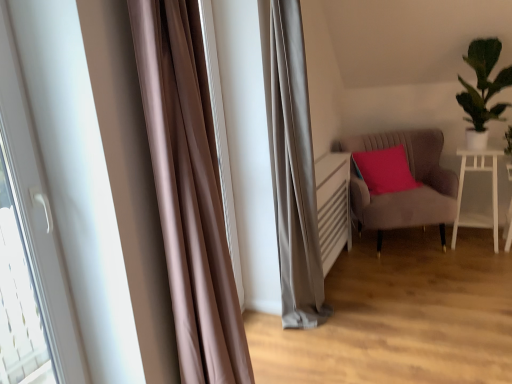
This screenshot has height=384, width=512. What do you see at coordinates (492, 191) in the screenshot?
I see `white glossy table at right` at bounding box center [492, 191].

Locate an element on the screen. The image size is (512, 384). suede-like beige armchair at right is located at coordinates (408, 190).

The width and height of the screenshot is (512, 384). I want to click on green leafy plant at upper right, so click(x=483, y=90).

The height and width of the screenshot is (384, 512). What do you see at coordinates (70, 178) in the screenshot?
I see `white glossy door at left` at bounding box center [70, 178].

This screenshot has width=512, height=384. Identify the location of white glossy table at right. (492, 191).

Is green leafy plant at upper right looking in the opposite direction of white glossy door at left?

No, white glossy door at left is not at the back of green leafy plant at upper right.

Considering the positions of objects green leafy plant at upper right and white glossy door at left in the image provided, who is more to the left, green leafy plant at upper right or white glossy door at left?

Positioned to the left is white glossy door at left.

Is green leafy plant at upper right surrounding white glossy door at left?

No, white glossy door at left is not surrounded by green leafy plant at upper right.

Does point (471, 91) come behind point (74, 277)?

Yes, point (471, 91) is behind point (74, 277).

In terms of width, does satin brown curtain at left look wider or thinner when compared to suede-like beige armchair at right?

satin brown curtain at left is thinner than suede-like beige armchair at right.

Which object is positioned more to the left, satin brown curtain at left or suede-like beige armchair at right?

From the viewer's perspective, satin brown curtain at left appears more on the left side.

From the image's perspective, which is below, satin brown curtain at left or suede-like beige armchair at right?

suede-like beige armchair at right.

Who is more distant, suede-like beige armchair at right or white glossy door at left?

suede-like beige armchair at right.

Consider the image. Is suede-like beige armchair at right shorter than white glossy door at left?

Yes.

Considering the relative positions of suede-like beige armchair at right and white glossy door at left in the image provided, is suede-like beige armchair at right to the left or to the right of white glossy door at left?

Clearly, suede-like beige armchair at right is on the right of white glossy door at left in the image.

Considering the positions of point (442, 144) and point (24, 47), is point (442, 144) closer or farther from the camera than point (24, 47)?

Clearly, point (442, 144) is more distant from the camera than point (24, 47).

From the picture: How many degrees apart are the facing directions of white glossy door at left and white glossy table at right?

There is a 90.9-degree angle between the facing directions of white glossy door at left and white glossy table at right.

Is white glossy door at left positioned with its back to white glossy table at right?

No, white glossy door at left is not facing the opposite direction of white glossy table at right.

From the image's perspective, which is below, white glossy door at left or white glossy table at right?

white glossy door at left appears lower in the image.

Based on the photo, considering the positions of objects suede-like beige armchair at right and satin brown curtain at left in the image provided, who is more to the left, suede-like beige armchair at right or satin brown curtain at left?

satin brown curtain at left.

Is suede-like beige armchair at right not near satin brown curtain at left?

Yes, suede-like beige armchair at right and satin brown curtain at left are located far from each other.

From the image's perspective, who appears lower, suede-like beige armchair at right or satin brown curtain at left?

suede-like beige armchair at right is shown below in the image.

Which is behind, point (365, 209) or point (181, 191)?

The point (365, 209) is farther.

Between white glossy table at right and white glossy door at left, which one has smaller size?

With smaller size is white glossy door at left.

From a real-world perspective, which is physically above, white glossy table at right or white glossy door at left?

white glossy door at left, from a real-world perspective.

Is white glossy table at right wider or thinner than white glossy door at left?

Clearly, white glossy table at right has more width compared to white glossy door at left.

Which object is further away from the camera taking this photo, white glossy table at right or white glossy door at left?

white glossy table at right is more distant.

How different are the orientations of satin brown curtain at left and green leafy plant at upper right in degrees?

satin brown curtain at left and green leafy plant at upper right are facing 90.1 degrees away from each other.

Is satin brown curtain at left completely or partially outside of green leafy plant at upper right?

That's correct, satin brown curtain at left is outside of green leafy plant at upper right.

Considering the relative sizes of satin brown curtain at left and green leafy plant at upper right in the image provided, is satin brown curtain at left wider than green leafy plant at upper right?

No, satin brown curtain at left is not wider than green leafy plant at upper right.

You are a GUI agent. You are given a task and a screenshot of the screen. Output one action in this format:
    pyautogui.click(x=<x>, y=<y>)
    Task: Click on the houseplant above the white glossy door at left (from the image's perspective)
    Image resolution: width=512 pixels, height=384 pixels.
    Given the screenshot: What is the action you would take?
    pyautogui.click(x=483, y=90)

Image resolution: width=512 pixels, height=384 pixels. What are the coordinates of `curtain in front of the suede-like beige armchair at right` in the screenshot? It's located at pyautogui.click(x=189, y=192).

Which object lies further to the anchor point white glossy table at right, white glossy door at left or suede-like beige armchair at right?

Among the two, white glossy door at left is located further to white glossy table at right.

Which object lies further to the anchor point satin brown curtain at left, suede-like beige armchair at right or green leafy plant at upper right?

The object further to satin brown curtain at left is green leafy plant at upper right.

Looking at the image, which one is located closer to suede-like beige armchair at right, white glossy door at left or white glossy table at right?

white glossy table at right lies closer to suede-like beige armchair at right than the other object.

From the image, which object appears to be nearer to white glossy table at right, satin brown curtain at left or white glossy door at left?

A: satin brown curtain at left is closer to white glossy table at right.

From the picture: Looking at the image, which one is located further to suede-like beige armchair at right, white glossy table at right or satin brown curtain at left?

satin brown curtain at left is further to suede-like beige armchair at right.

Considering their positions, is suede-like beige armchair at right positioned further to white glossy door at left than satin brown curtain at left?

Based on the image, suede-like beige armchair at right appears to be further to white glossy door at left.

When comparing their distances from white glossy door at left, does green leafy plant at upper right or suede-like beige armchair at right seem closer?

The object closer to white glossy door at left is suede-like beige armchair at right.

Which object lies nearer to the anchor point green leafy plant at upper right, white glossy door at left or white glossy table at right?

Among the two, white glossy table at right is located nearer to green leafy plant at upper right.

The height and width of the screenshot is (384, 512). Find the location of `houseplant between satin brown curtain at left and white glossy table at right from left to right`. houseplant between satin brown curtain at left and white glossy table at right from left to right is located at coordinates (483, 90).

You are a GUI agent. You are given a task and a screenshot of the screen. Output one action in this format:
    pyautogui.click(x=<x>, y=<y>)
    Task: Click on the chair situated between satin brown curtain at left and white glossy table at right from left to right
    This screenshot has width=512, height=384.
    Given the screenshot: What is the action you would take?
    pyautogui.click(x=408, y=190)

The image size is (512, 384). In order to click on curtain located between white glossy door at left and suede-like beige armchair at right in the depth direction in this screenshot , I will do `click(189, 192)`.

Find the location of `chair between green leafy plant at upper right and white glossy table at right vertically`. chair between green leafy plant at upper right and white glossy table at right vertically is located at coordinates (408, 190).